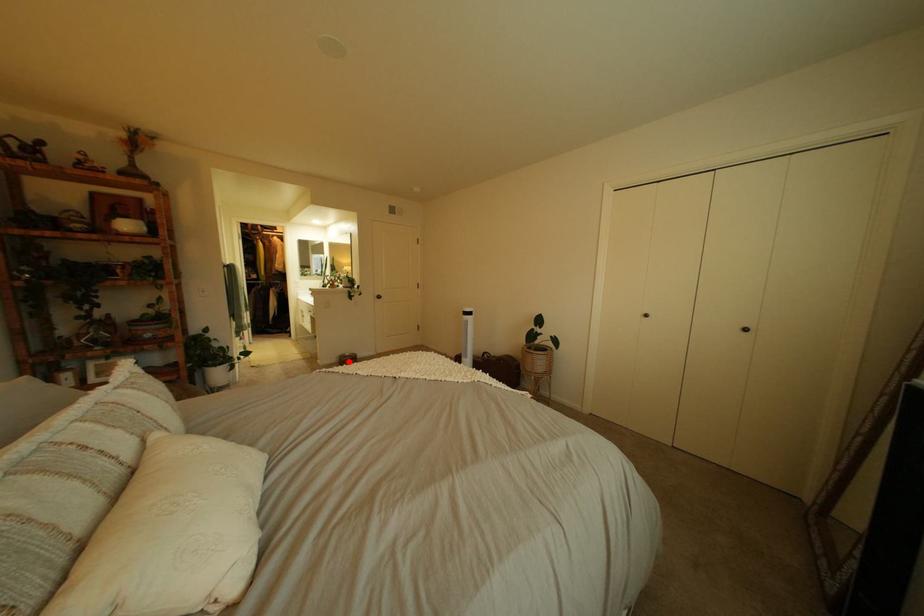
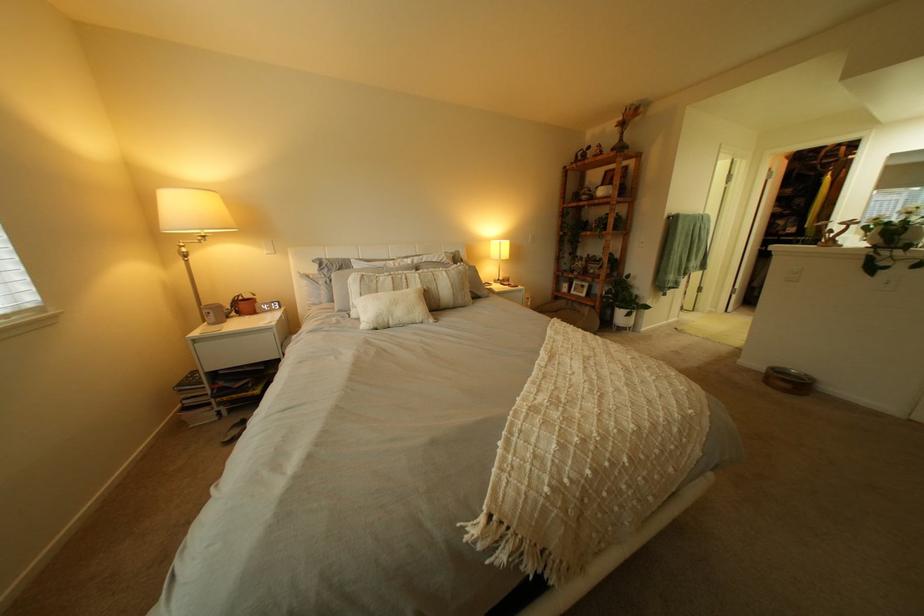
Where in the second image is the point corresponding to the highlighted location from the first image?

(779, 369)